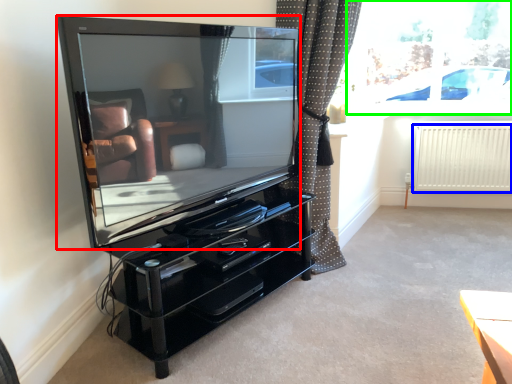
Question: Estimate the real-world distances between objects in this image. Which object is farther from television (highlighted by a red box), radiator (highlighted by a blue box) or window screen (highlighted by a green box)?

Choices:
 (A) radiator
 (B) window screen

Answer: (A)